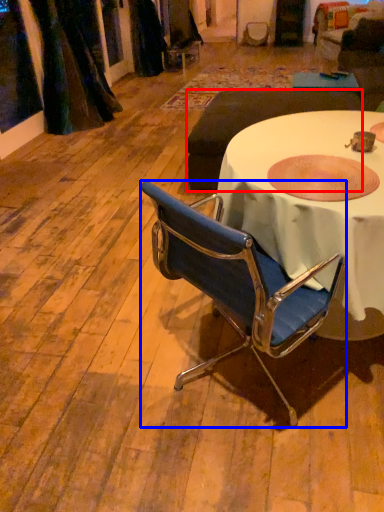
Question: Among these objects, which one is farthest to the camera, studio couch (highlighted by a red box) or chair (highlighted by a blue box)?

Choices:
 (A) studio couch
 (B) chair

Answer: (A)